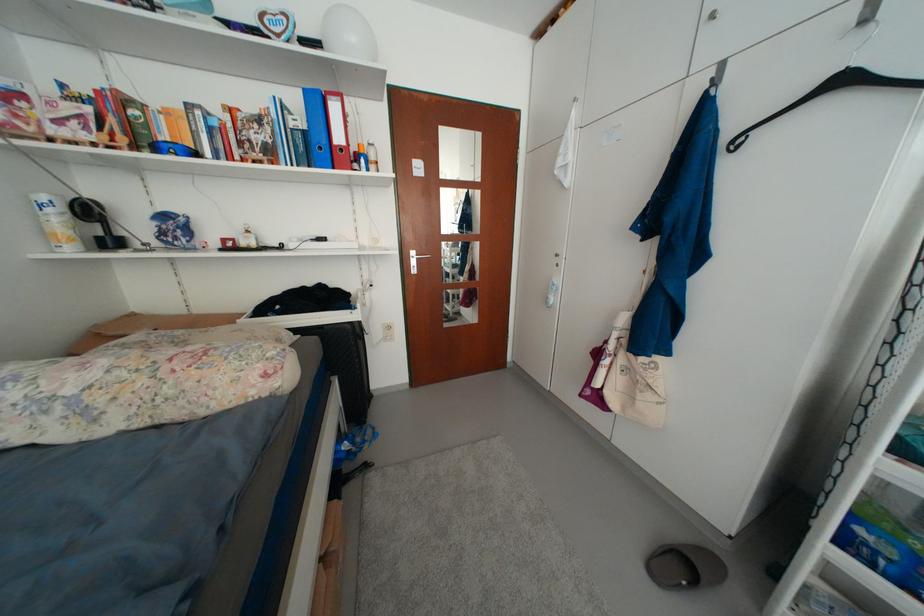
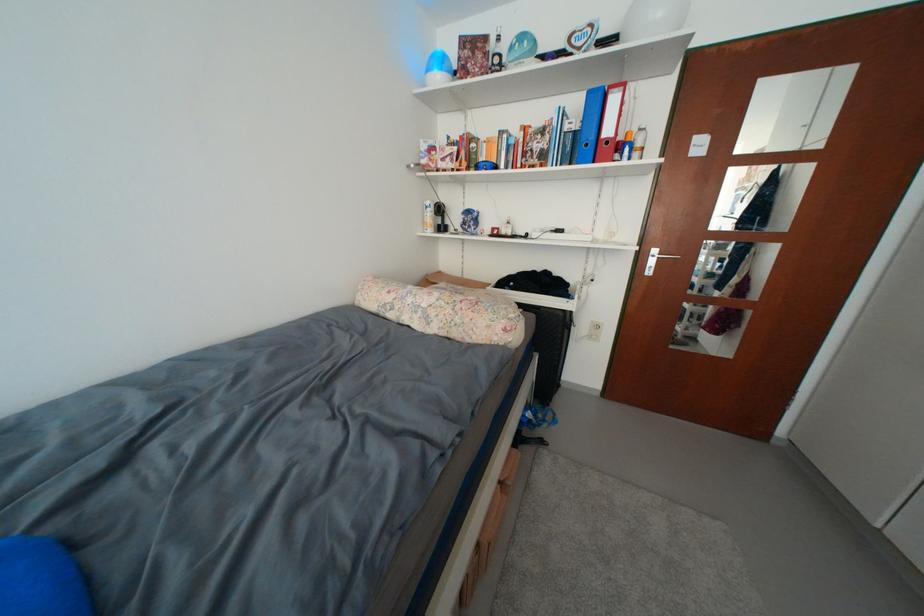
Find the pixel in the second image that matches point 310,151 in the first image.

(578, 151)